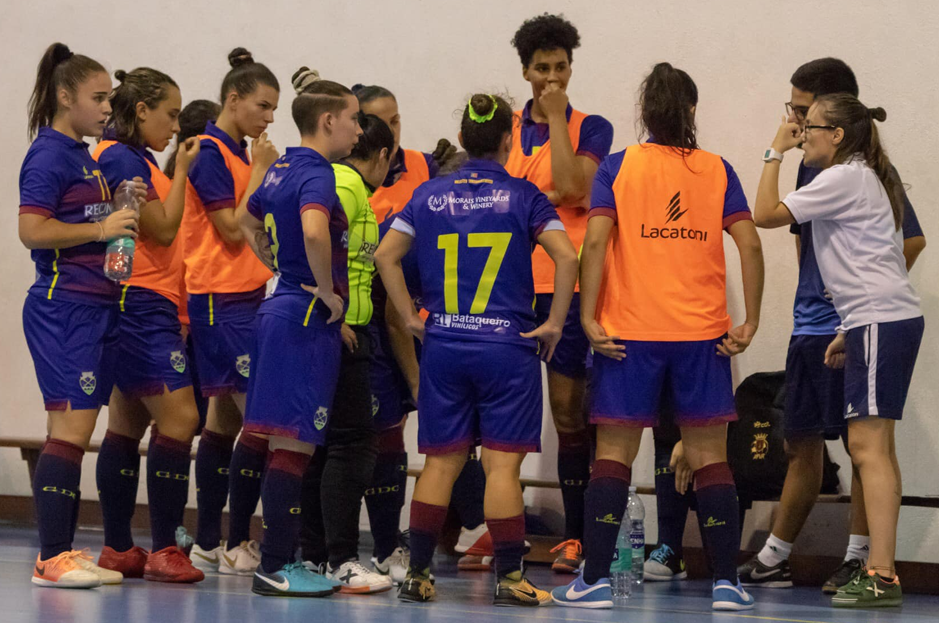
Where is `floor`? This screenshot has width=939, height=623. floor is located at coordinates (20, 582), (673, 616).